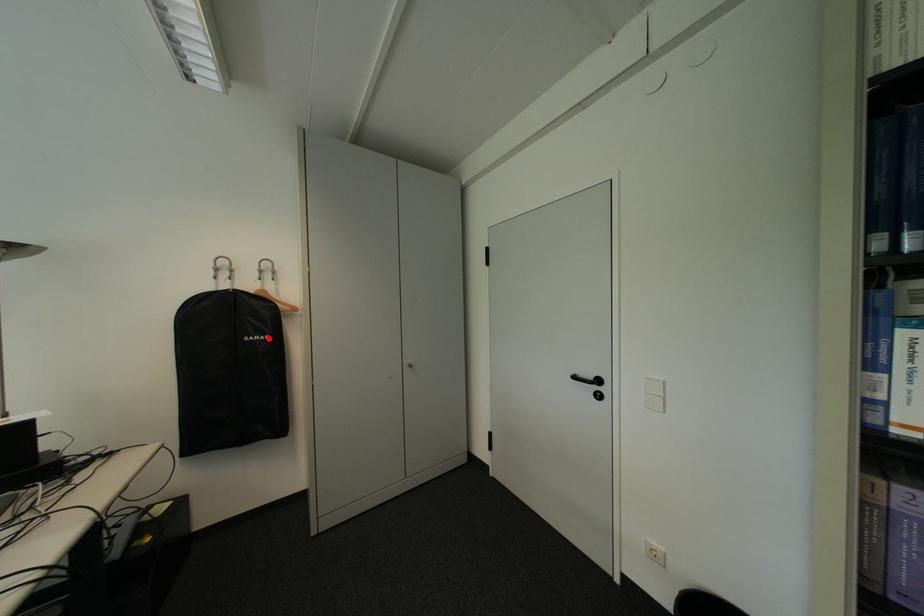
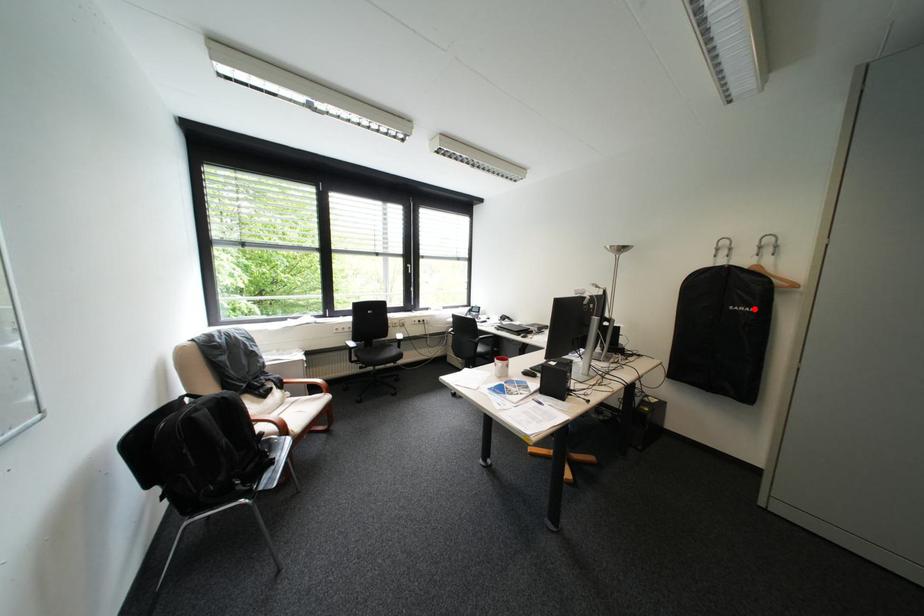
I am providing you with two images of the same scene from different viewpoints. A red point is marked on the first image and another point is marked on the second image. Does the point marked in image1 correspond to the same location as the one in image2?

Yes